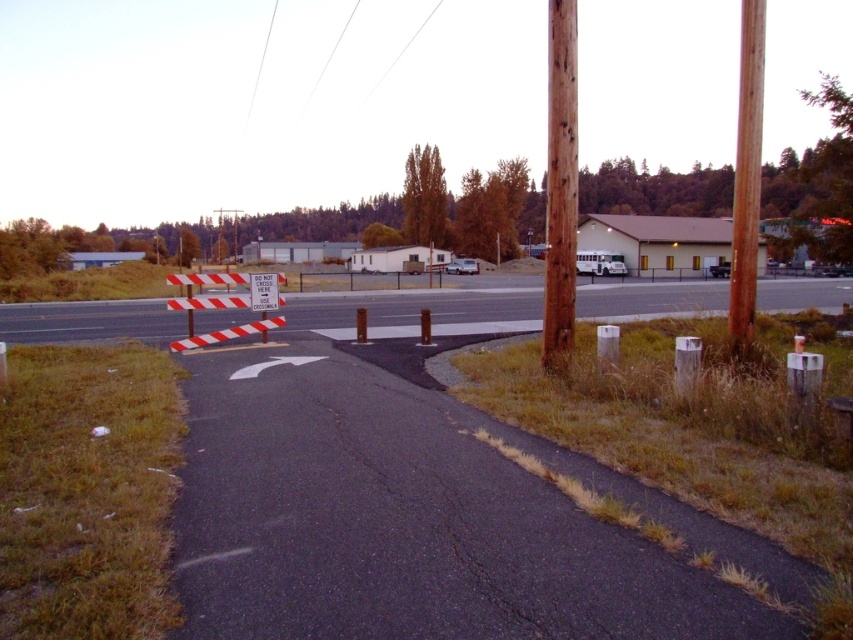
Question: Can you confirm if brown wooden pole at right is bigger than white paper sign at center?

Choices:
 (A) no
 (B) yes

Answer: (B)

Question: Is brown rough wood pole at upper right to the left of white paper sign at center from the viewer's perspective?

Choices:
 (A) yes
 (B) no

Answer: (B)

Question: Which point is farther to the camera?

Choices:
 (A) white striped barrier at center
 (B) white paper sign at center
 (C) brown rough wood pole at upper right
 (D) brown wooden pole at right

Answer: (A)

Question: Which object is closer to the camera taking this photo?

Choices:
 (A) white striped barrier at center
 (B) white paper sign at center

Answer: (B)

Question: Is white striped barrier at center to the right of brown rough wood pole at upper right from the viewer's perspective?

Choices:
 (A) no
 (B) yes

Answer: (B)

Question: Which of these objects is positioned closest to the brown rough wood pole at upper right?

Choices:
 (A) white striped barrier at center
 (B) white paper sign at center

Answer: (B)